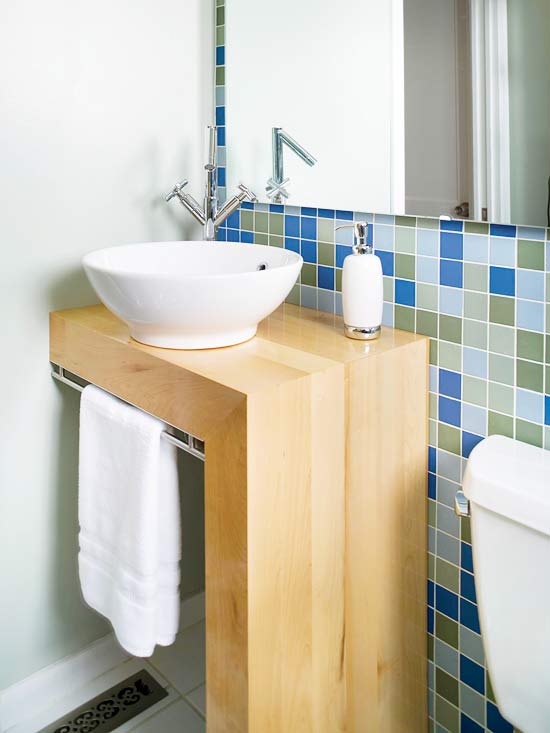
This screenshot has width=550, height=733. I want to click on tile, so pos(437,635).